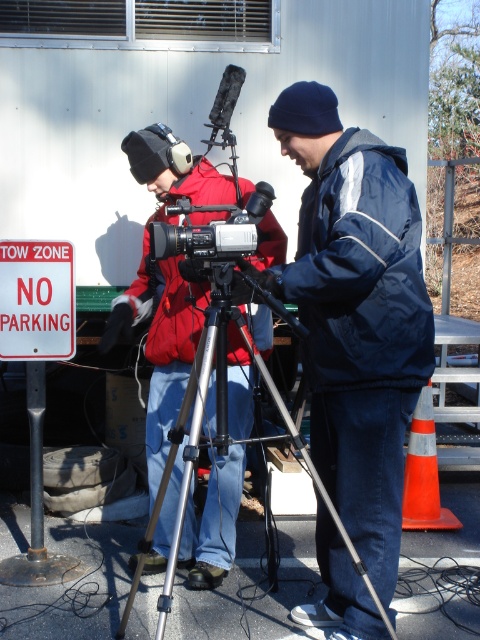
You are a camera operator trying to set up a shot where both the dark blue jacket at center and the silver metallic tripod at center are in frame. The camera has a 10 inch wide lens. Can you fit both objects into the frame without moving the camera?

The distance between the dark blue jacket at center and the silver metallic tripod at center is 12.03 inches. Since the camera lens is only 10 inches wide, it cannot capture both objects within the frame without moving the camera.

You are a drone operator trying to capture a closeup of the dark blue jacket at center. The drone is currently hovering at point 0.5, 0.7. Should you move the drone north or south to align it with the jacket?

The dark blue jacket at center is located at point (356, 314). Since the drone is at (336, 320), it needs to move north to increase the y coordinate from 0.7 to 0.742. Therefore, move north.